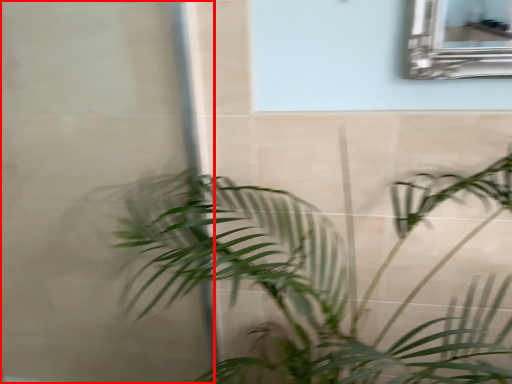
Question: From the image, what is the correct spatial relationship of glass door (annotated by the red box) in relation to houseplant?

Choices:
 (A) left
 (B) right

Answer: (A)